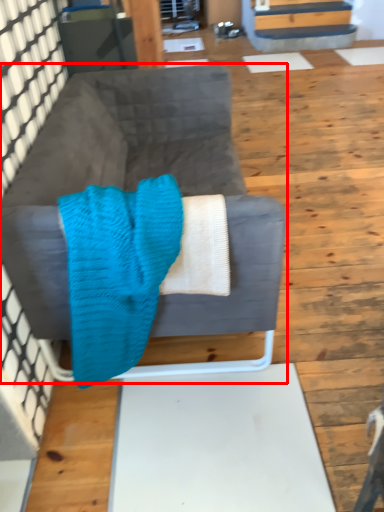
Question: Considering the relative positions of studio couch (annotated by the red box) and blanket in the image provided, where is studio couch (annotated by the red box) located with respect to the staircase?

Choices:
 (A) left
 (B) right

Answer: (B)